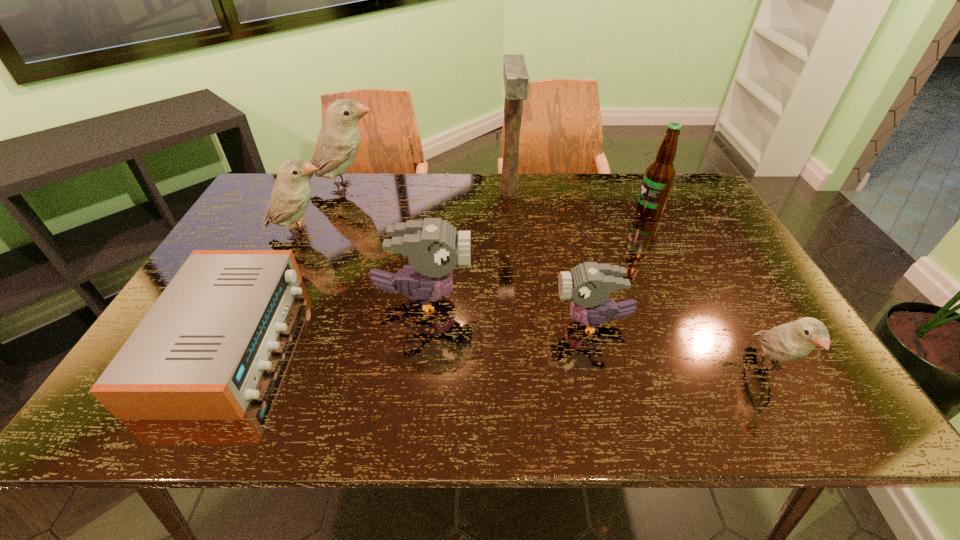
The width and height of the screenshot is (960, 540). I want to click on object that is the closest to the bigger gray bird, so click(198, 354).

The height and width of the screenshot is (540, 960). I want to click on the third closest bird relative to the rightmost object, so click(290, 196).

Identify which bird is located as the third nearest to the brown beer bottle. Please provide its 2D coordinates. Your answer should be formatted as a tuple, i.e. [(x, y)], where the tuple contains the x and y coordinates of a point satisfying the conditions above.

[(434, 248)]

Identify the location of the closest white bird to the fifth nearest object. (338, 142).

This screenshot has height=540, width=960. Find the location of `white bird that stands as the closest to the tallest object`. white bird that stands as the closest to the tallest object is located at coordinates (338, 142).